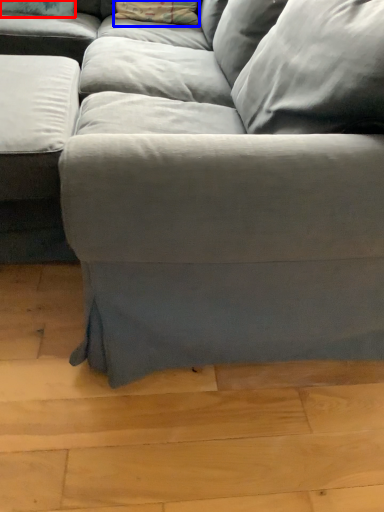
Question: Which object appears farthest to the camera in this image, pillow (highlighted by a red box) or pillow (highlighted by a blue box)?

Choices:
 (A) pillow
 (B) pillow

Answer: (B)